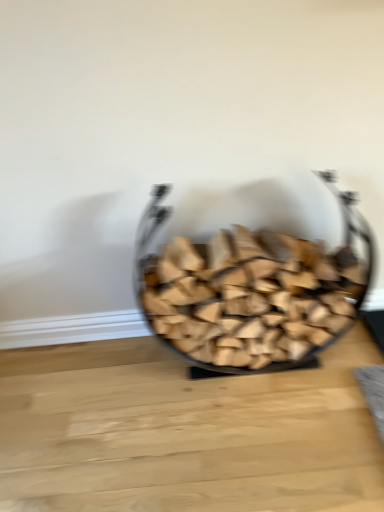
Question: Which is correct: wooden logs at center is inside natural wood table at center, or outside of it?

Choices:
 (A) outside
 (B) inside

Answer: (A)

Question: Considering the positions of wooden logs at center and natural wood table at center in the image, is wooden logs at center bigger or smaller than natural wood table at center?

Choices:
 (A) small
 (B) big

Answer: (B)

Question: Is point (198, 334) positioned closer to the camera than point (248, 408)?

Choices:
 (A) farther
 (B) closer

Answer: (A)

Question: From a real-world perspective, is natural wood table at center above or below wooden logs at center?

Choices:
 (A) below
 (B) above

Answer: (A)

Question: Is natural wood table at center wider or thinner than wooden logs at center?

Choices:
 (A) wide
 (B) thin

Answer: (A)

Question: Is point (233, 472) closer or farther from the camera than point (163, 340)?

Choices:
 (A) farther
 (B) closer

Answer: (B)

Question: In the image, is natural wood table at center positioned in front of or behind wooden logs at center?

Choices:
 (A) behind
 (B) front

Answer: (A)